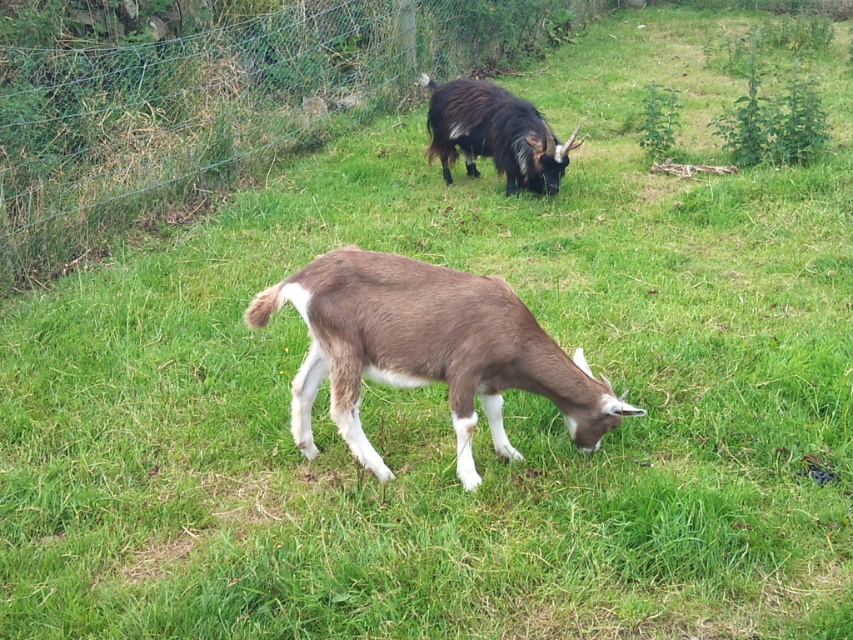
In the scene shown: How much distance is there between metal wire fence at upper center and brown furry goat at center?

A distance of 3.26 meters exists between metal wire fence at upper center and brown furry goat at center.

In the scene shown: Does metal wire fence at upper center have a lesser width compared to brown furry goat at center?

Yes, metal wire fence at upper center is thinner than brown furry goat at center.

Is point (396, 48) more distant than point (302, 403)?

Yes, it is.

You are a GUI agent. You are given a task and a screenshot of the screen. Output one action in this format:
    pyautogui.click(x=<x>, y=<y>)
    Task: Click on the metal wire fence at upper center
    
    Given the screenshot: What is the action you would take?
    pyautogui.click(x=222, y=106)

Between brown furry goat at center and dark brown woolen goat at upper center, which one is positioned higher?

Positioned higher is dark brown woolen goat at upper center.

Can you confirm if brown furry goat at center is bigger than dark brown woolen goat at upper center?

Yes.

Find the location of a particular element. brown furry goat at center is located at coordinates (427, 349).

The height and width of the screenshot is (640, 853). I want to click on brown furry goat at center, so click(x=427, y=349).

Can you confirm if metal wire fence at upper center is bigger than dark brown woolen goat at upper center?

Incorrect, metal wire fence at upper center is not larger than dark brown woolen goat at upper center.

Who is positioned more to the left, metal wire fence at upper center or dark brown woolen goat at upper center?

metal wire fence at upper center is more to the left.

At what (x,y) coordinates should I click in order to perform the action: click on metal wire fence at upper center. Please return your answer as a coordinate pair (x, y). Image resolution: width=853 pixels, height=640 pixels. Looking at the image, I should click on [x=222, y=106].